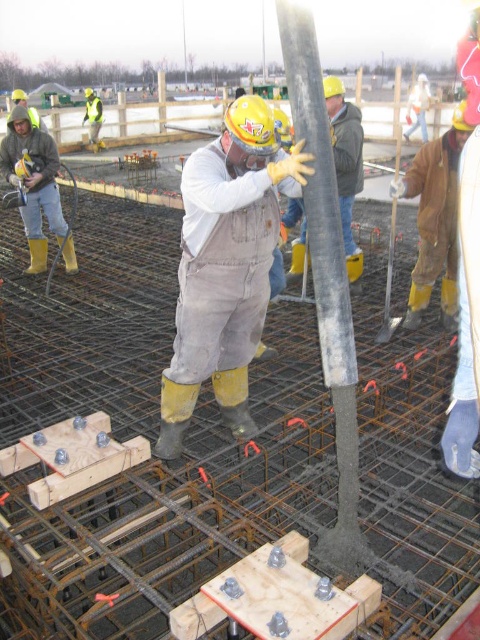
Question: Does smooth concrete pole at center appear under yellow rubber boots at left?

Choices:
 (A) no
 (B) yes

Answer: (B)

Question: Among these points, which one is nearest to the camera?

Choices:
 (A) (33, 266)
 (B) (301, 216)
 (C) (340, 308)
 (D) (92, 138)

Answer: (C)

Question: Can you confirm if gray denim overalls at center is positioned to the left of reflective yellow safety vest at upper left?

Choices:
 (A) yes
 (B) no

Answer: (B)

Question: Can you confirm if gray denim overalls at center is wider than smooth concrete pole at center?

Choices:
 (A) no
 (B) yes

Answer: (B)

Question: Which point is closer to the camera?

Choices:
 (A) [337, 170]
 (B) [84, 122]
 (C) [69, 257]

Answer: (A)

Question: Which point is farther to the camera?

Choices:
 (A) reflective yellow safety vest at upper left
 (B) gray denim overalls at center
 (C) matte gray pole at center

Answer: (A)